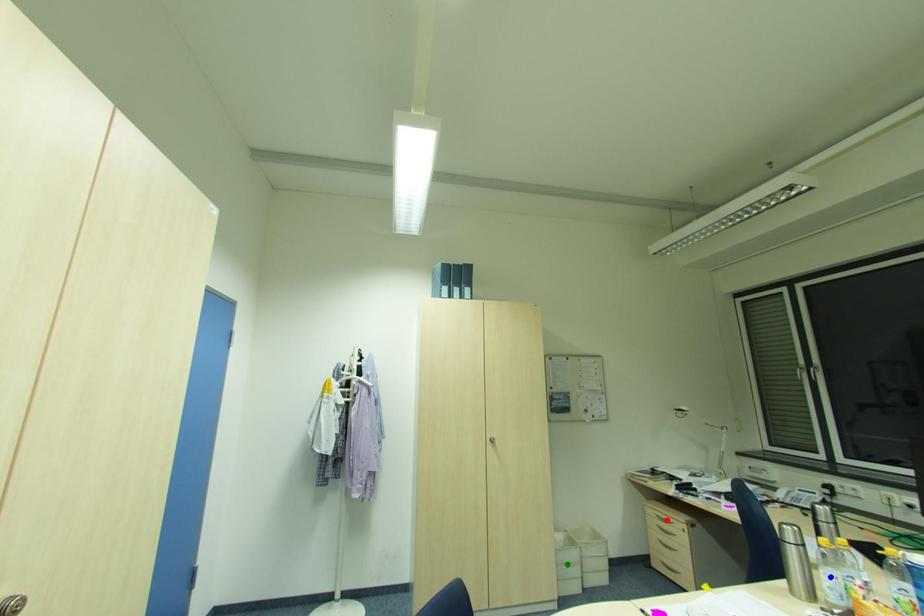
Order these from nearest to farthest:
A) green point
B) red point
C) blue point

blue point
green point
red point